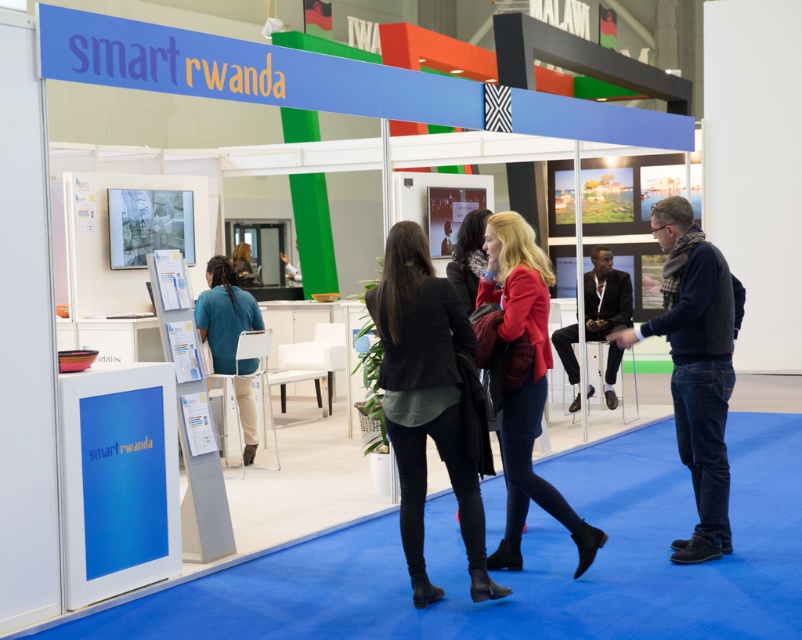
Question: Which object appears closest to the camera in this image?

Choices:
 (A) blue fabric shirt at center
 (B) black leather jacket at center
 (C) red leather jacket at center

Answer: (B)

Question: Which of the following is the closest to the observer?

Choices:
 (A) red leather jacket at center
 (B) black leather jacket at center
 (C) blue fabric shirt at center

Answer: (B)

Question: Can you confirm if black leather jacket at center is bigger than red leather jacket at center?

Choices:
 (A) no
 (B) yes

Answer: (A)

Question: Does red leather jacket at center lie behind blue fabric shirt at center?

Choices:
 (A) yes
 (B) no

Answer: (B)

Question: Is black leather jacket at center above red leather jacket at center?

Choices:
 (A) no
 (B) yes

Answer: (A)

Question: Which of the following is the farthest from the observer?

Choices:
 (A) blue fabric shirt at center
 (B) black leather jacket at center

Answer: (A)